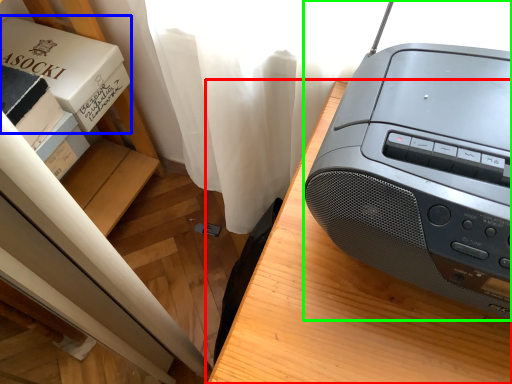
Question: Which object is the closest to the furniture (highlighted by a red box)? Choose among these: paperback book (highlighted by a blue box) or printer (highlighted by a green box).

Choices:
 (A) paperback book
 (B) printer

Answer: (B)